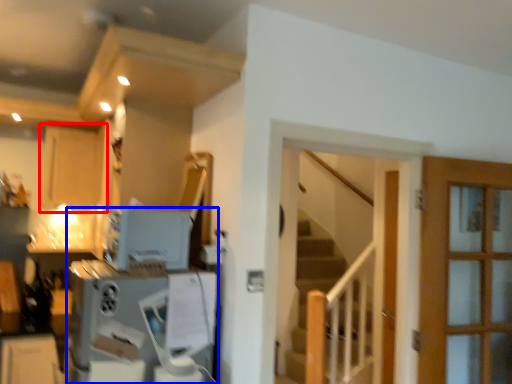
Question: Which of the following is the closest to the observer, cabinetry (highlighted by a red box) or appliance (highlighted by a blue box)?

Choices:
 (A) cabinetry
 (B) appliance

Answer: (B)